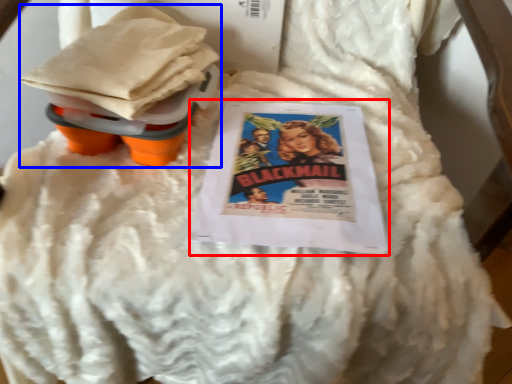
Question: Which object appears farthest to the camera in this image, comic book (highlighted by a red box) or toy (highlighted by a blue box)?

Choices:
 (A) comic book
 (B) toy

Answer: (A)